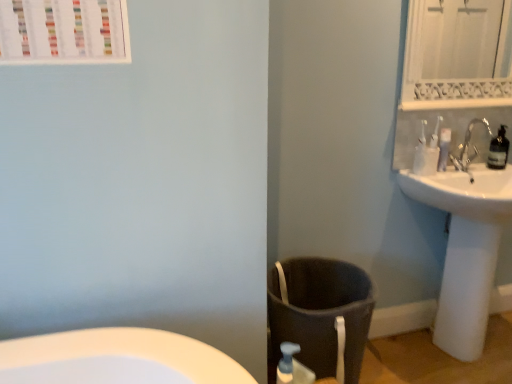
Question: Considering the positions of transparent plastic bottle at upper right and translucent plastic soap dispenser at lower center in the image, is transparent plastic bottle at upper right wider or thinner than translucent plastic soap dispenser at lower center?

Choices:
 (A) thin
 (B) wide

Answer: (B)

Question: From the image's perspective, relative to translucent plastic soap dispenser at lower center, is transparent plastic bottle at upper right above or below?

Choices:
 (A) below
 (B) above

Answer: (B)

Question: Which object is the farthest from the transparent plastic bottle at upper right?

Choices:
 (A) white glossy sink at right
 (B) translucent plastic soap dispenser at lower center
 (C) white plastic toilet paper at upper right
 (D) dark gray fabric laundry basket at lower center
 (E) white plastic toothbrushes at upper right

Answer: (B)

Question: Which of these objects is positioned farthest from the translucent plastic soap dispenser at lower center?

Choices:
 (A) dark gray fabric laundry basket at lower center
 (B) white plastic toothbrushes at upper right
 (C) white plastic toilet paper at upper right
 (D) transparent plastic bottle at upper right
 (E) white textured mirror at upper right

Answer: (E)